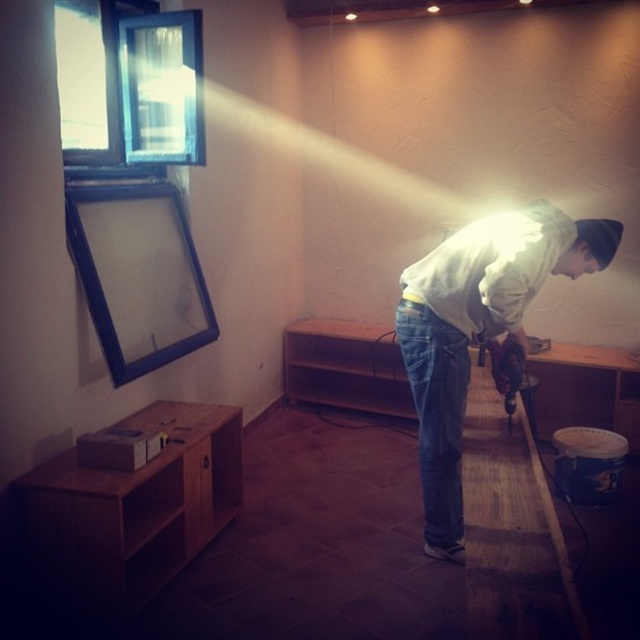
Can you confirm if white matte shirt at center is smaller than denim jeans at center?

Actually, white matte shirt at center might be larger than denim jeans at center.

Between white matte shirt at center and denim jeans at center, which one has less height?

denim jeans at center

The width and height of the screenshot is (640, 640). What are the coordinates of `white matte shirt at center` in the screenshot? It's located at (477, 330).

Is point (516, 257) less distant than point (502, 372)?

Yes, point (516, 257) is closer to viewer.

Is white matte shirt at center positioned at the back of metallic drill at lower center?

No, it is not.

Is point (458, 349) more distant than point (508, 413)?

No, (458, 349) is in front of (508, 413).

This screenshot has height=640, width=640. Identify the location of white matte shirt at center. (477, 330).

Who is more distant from viewer, [448,435] or [506,369]?

The point [448,435] is more distant.

Can you confirm if denim jeans at center is bigger than metallic drill at lower center?

Yes, denim jeans at center is bigger than metallic drill at lower center.

Does point (444, 513) come in front of point (508, 372)?

No, (444, 513) is behind (508, 372).

Image resolution: width=640 pixels, height=640 pixels. Find the location of `denim jeans at center`. denim jeans at center is located at coordinates (436, 413).